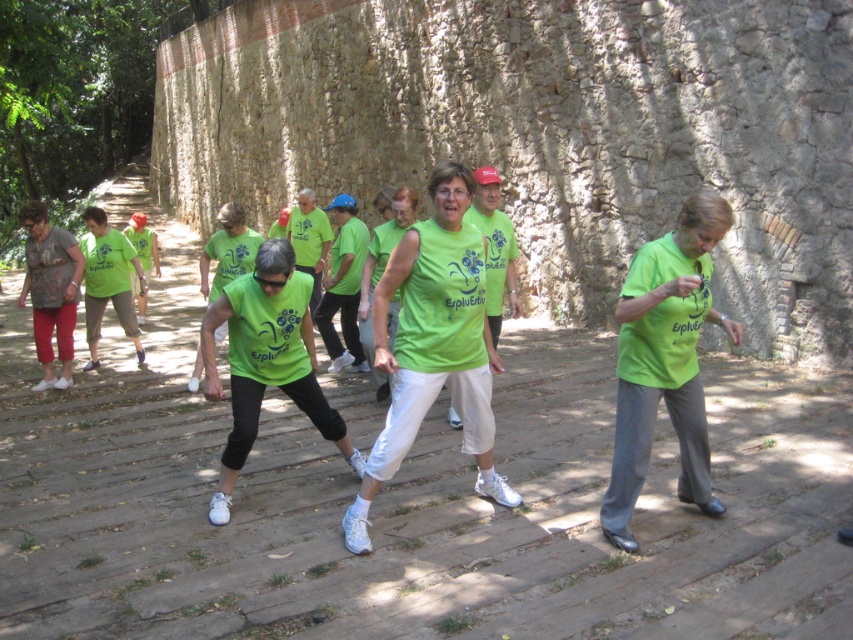
Question: Which object is the farthest from the matte green t-shirt at left?

Choices:
 (A) green matte tank top at center
 (B) matte gray shirt at left

Answer: (A)

Question: Can you confirm if matte green t-shirt at left is bigger than green fabric shirt at center?

Choices:
 (A) no
 (B) yes

Answer: (A)

Question: Which point is farther from the camera taking this photo?

Choices:
 (A) (51, 300)
 (B) (363, 476)
 (C) (654, 250)

Answer: (A)

Question: Is green matte tank top at center wider than green fabric shirt at center?

Choices:
 (A) no
 (B) yes

Answer: (B)

Question: Can you confirm if green matte shirt at center is smaller than matte green t-shirt at left?

Choices:
 (A) no
 (B) yes

Answer: (A)

Question: Which object is positioned closest to the green matte tank top at center?

Choices:
 (A) matte gray shirt at left
 (B) green fabric shirt at center

Answer: (B)